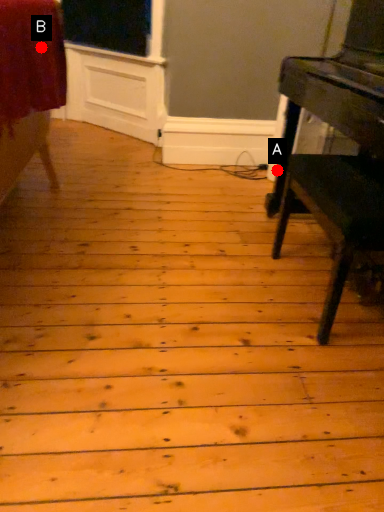
Question: Two points are circled on the image, labeled by A and B beside each circle. Which point is further to the camera?

Choices:
 (A) A is further
 (B) B is further

Answer: (A)